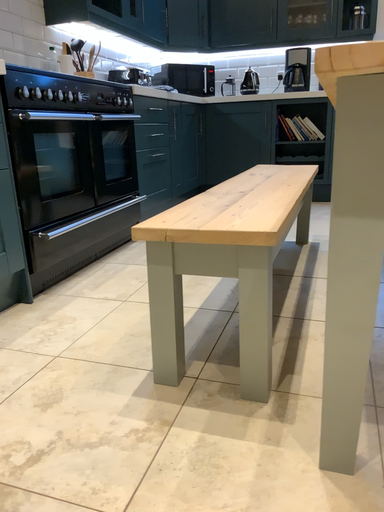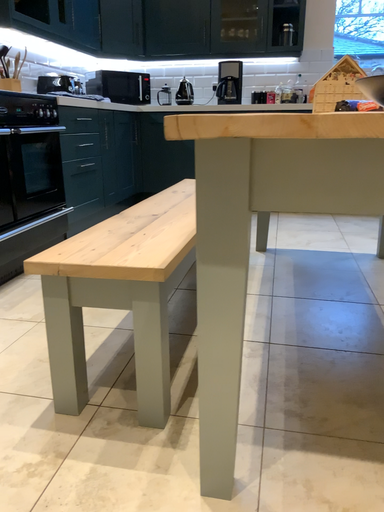
Question: Which way did the camera rotate in the video?

Choices:
 (A) rotated right
 (B) rotated left

Answer: (A)